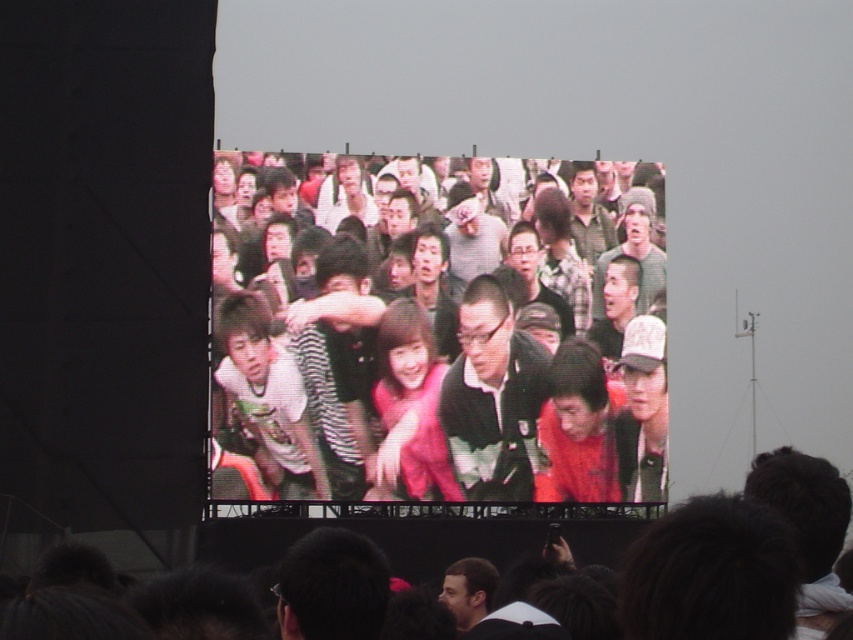
Question: Can you confirm if matte black jacket at center is positioned below pink fabric crowd at center?

Choices:
 (A) no
 (B) yes

Answer: (A)

Question: Which object is closer to the camera taking this photo?

Choices:
 (A) matte black jacket at center
 (B) pink fabric crowd at center

Answer: (B)

Question: Considering the relative positions of matte black jacket at center and pink fabric crowd at center in the image provided, where is matte black jacket at center located with respect to pink fabric crowd at center?

Choices:
 (A) above
 (B) below

Answer: (A)

Question: Does matte black jacket at center have a larger size compared to pink fabric crowd at center?

Choices:
 (A) no
 (B) yes

Answer: (A)